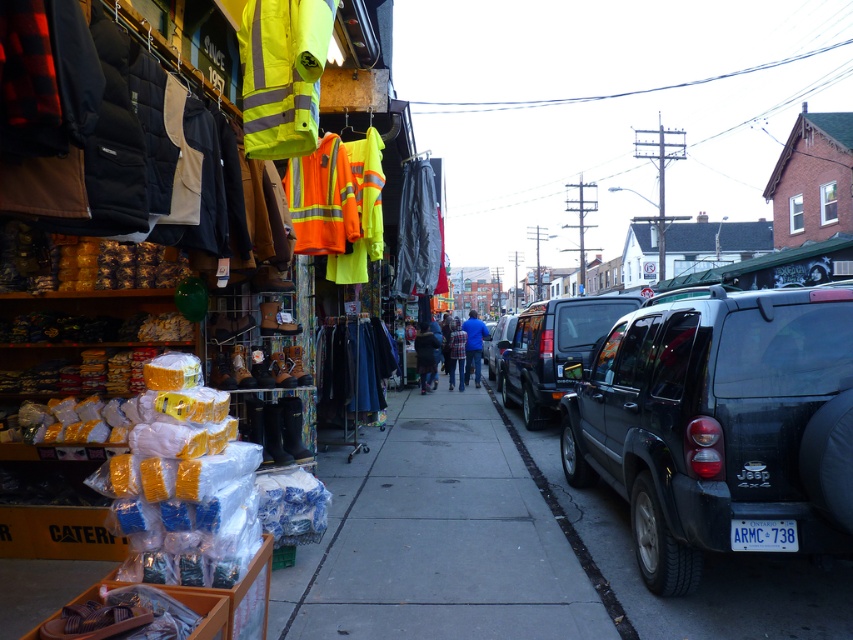
Question: Which object is the farthest from the black asphalt curb at lower right?

Choices:
 (A) matte black suv at center-right
 (B) white plastic license plate at center
 (C) dark blue jeans at center
 (D) blue fabric jacket at center

Answer: (D)

Question: Can you confirm if matte black suv at right is positioned to the right of yellow reflective safety vest at upper center?

Choices:
 (A) no
 (B) yes

Answer: (B)

Question: Which object appears closest to the camera in this image?

Choices:
 (A) blue denim jeans at center
 (B) black asphalt curb at lower right

Answer: (B)

Question: Does matte black suv at right appear on the right side of blue denim jeans at center?

Choices:
 (A) no
 (B) yes

Answer: (B)

Question: Is matte black suv at center-right bigger than blue denim jeans at center?

Choices:
 (A) no
 (B) yes

Answer: (A)

Question: Which object is positioned closest to the matte black suv at center-right?

Choices:
 (A) blue fabric jacket at center
 (B) yellow reflective safety vest at upper center
 (C) black asphalt curb at lower right

Answer: (C)